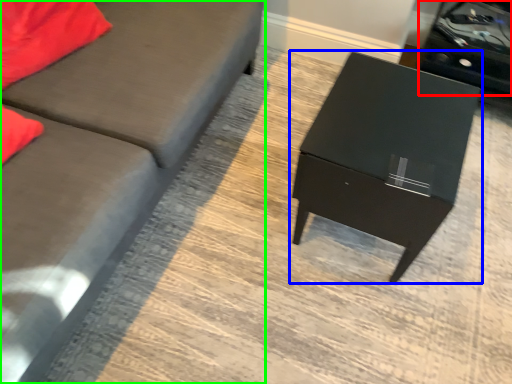
Question: Which object is positioned closest to side table (highlighted by a red box)? Select from table (highlighted by a blue box) and studio couch (highlighted by a green box).

Choices:
 (A) table
 (B) studio couch

Answer: (A)